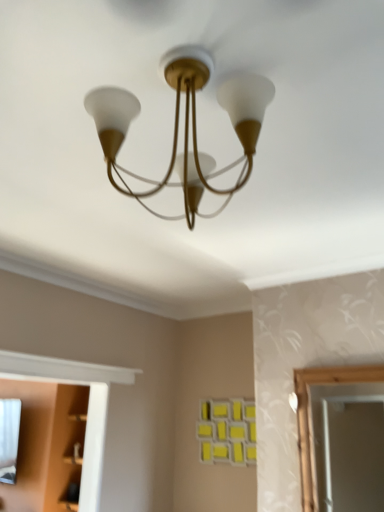
The height and width of the screenshot is (512, 384). Describe the element at coordinates (185, 125) in the screenshot. I see `matte gold chandelier at center` at that location.

I want to click on matte gold chandelier at center, so click(185, 125).

The width and height of the screenshot is (384, 512). In order to click on matte gold chandelier at center in this screenshot , I will do `click(185, 125)`.